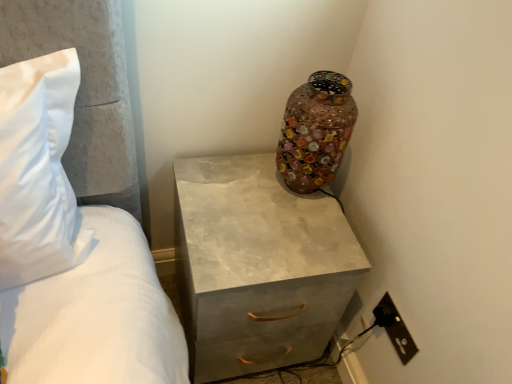
Question: From their relative heights in the image, would you say multicolored mosaic vase at upper right is taller or shorter than matte concrete chest of drawers at center?

Choices:
 (A) tall
 (B) short

Answer: (B)

Question: Choose the correct answer: Is multicolored mosaic vase at upper right inside matte concrete chest of drawers at center or outside it?

Choices:
 (A) inside
 (B) outside

Answer: (B)

Question: Estimate the real-world distances between objects in this image. Which object is closer to the black plastic outlet at lower right?

Choices:
 (A) matte concrete chest of drawers at center
 (B) multicolored mosaic vase at upper right

Answer: (A)

Question: Considering the real-world distances, which object is closest to the matte concrete chest of drawers at center?

Choices:
 (A) multicolored mosaic vase at upper right
 (B) black plastic outlet at lower right

Answer: (A)